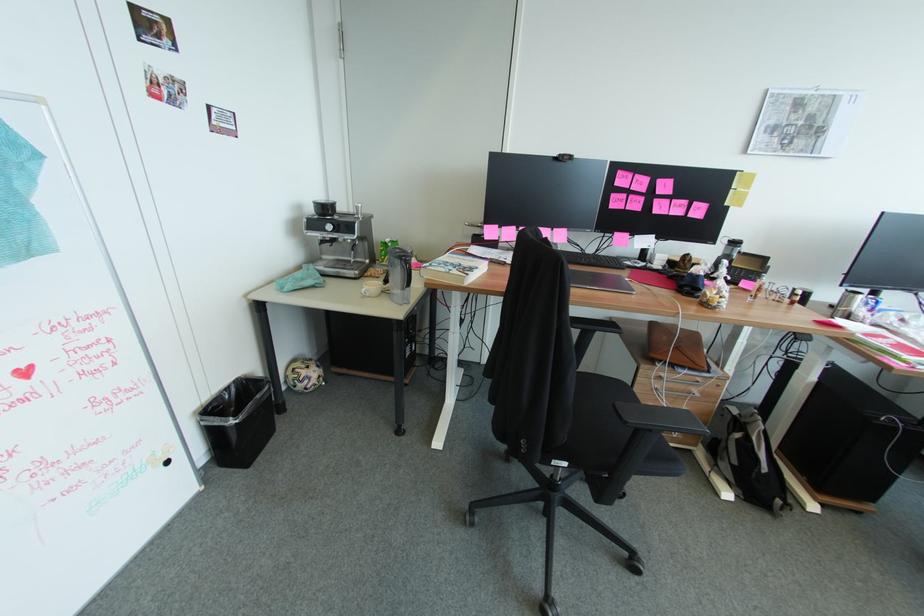
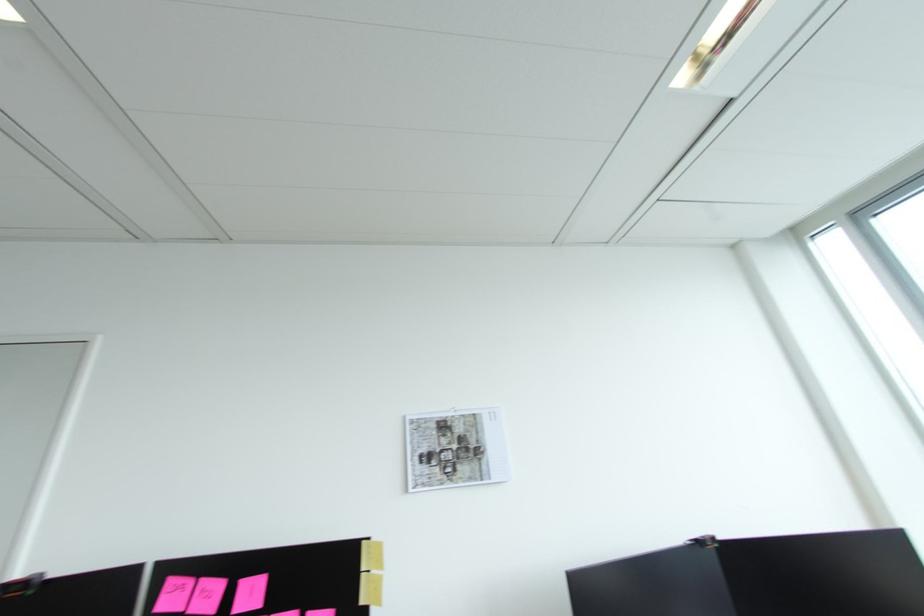
Where in the second image is the point corresponding to pixel 675 192 from the first image?

(262, 605)